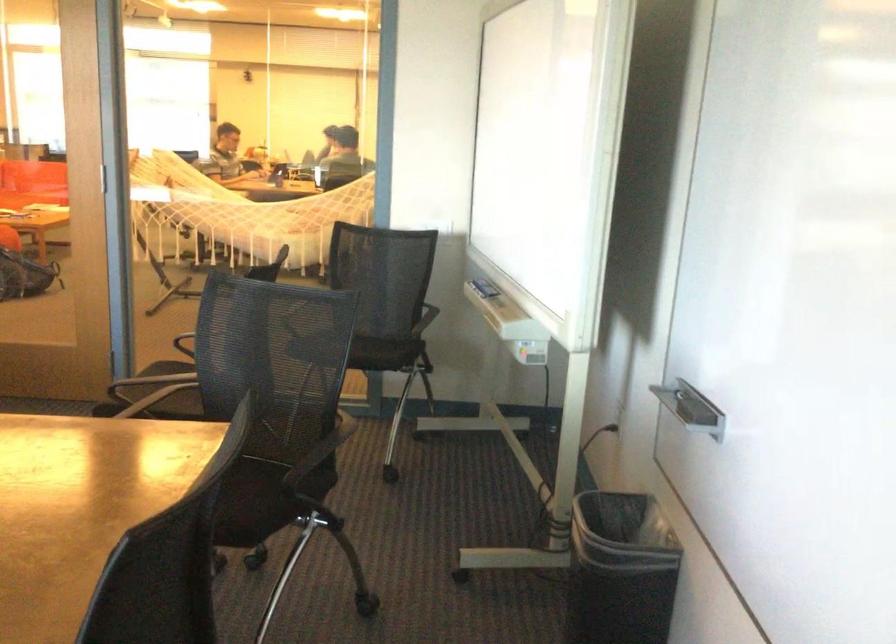
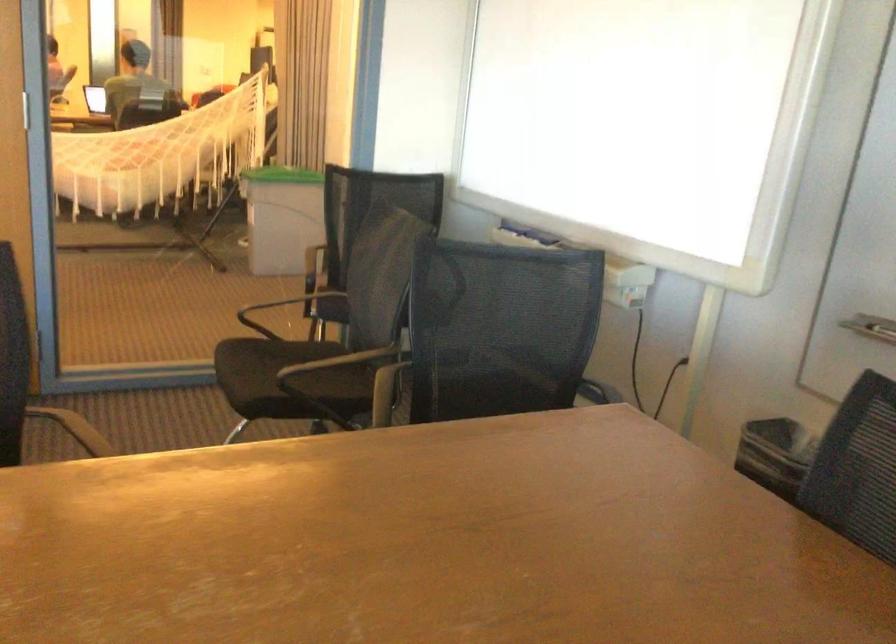
Question: I am providing you with two images of the same scene from different viewpoints. After the viewpoint changes to image2, which objects are now occluded?

Choices:
 (A) black trash can
 (B) green trash can lid
 (C) chair sitting surface
 (D) black clip hanger

Answer: (A)